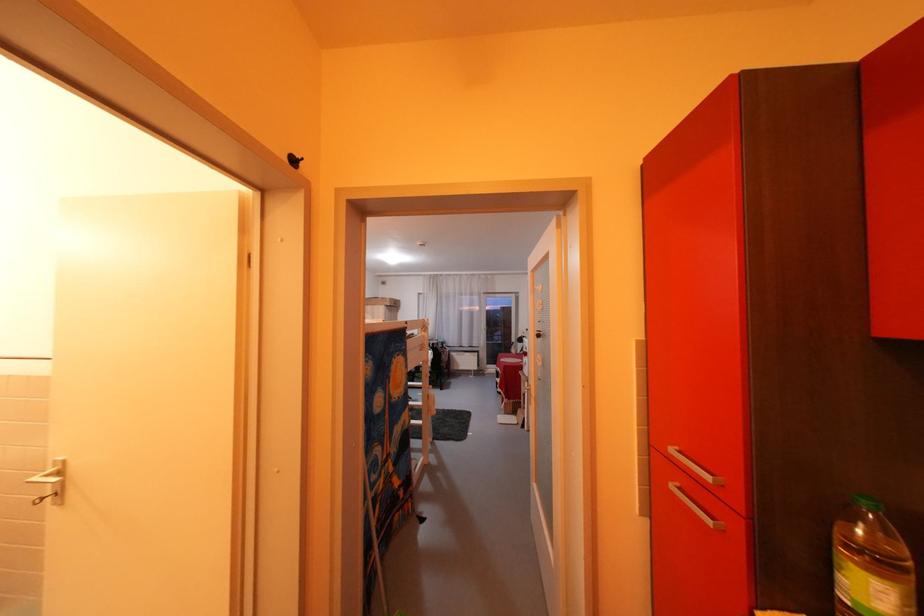
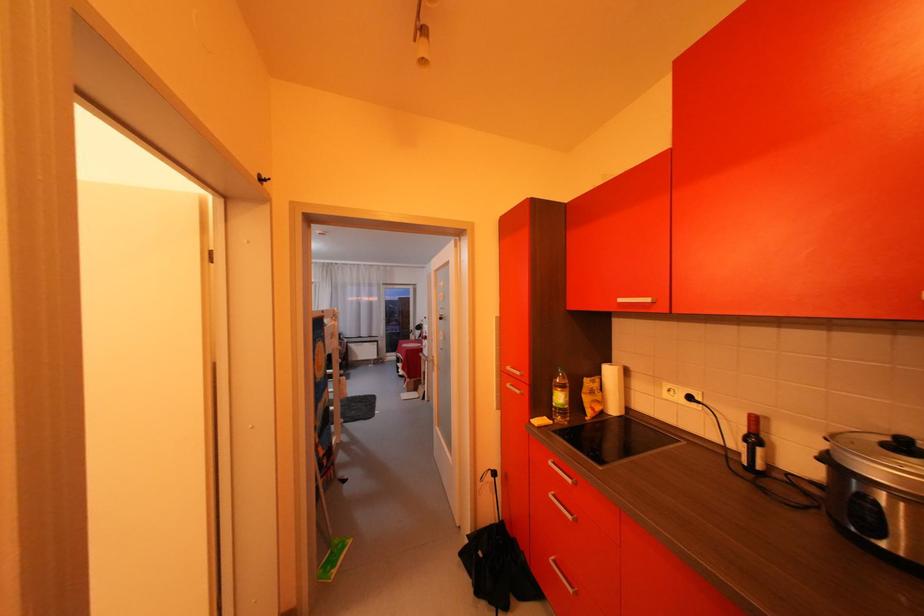
Question: The camera is either moving clockwise (left) or counter-clockwise (right) around the object. The first image is from the beginning of the video and the second image is from the end. Is the camera moving left or right when shooting the video?

Choices:
 (A) Left
 (B) Right

Answer: (A)